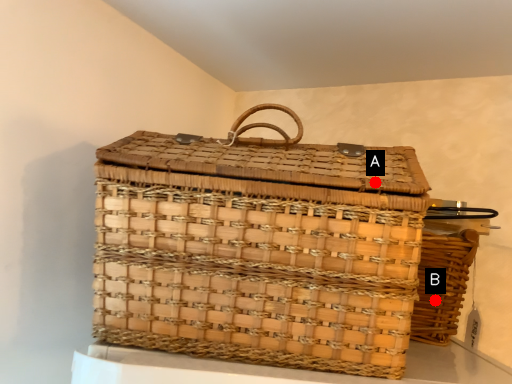
Question: Two points are circled on the image, labeled by A and B beside each circle. Among these points, which one is nearest to the camera?

Choices:
 (A) A is closer
 (B) B is closer

Answer: (A)